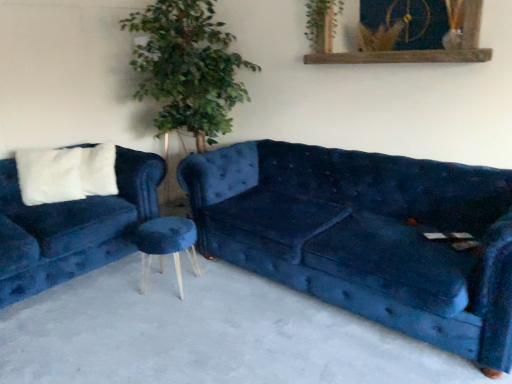
Find the location of a particular element. free space to the left of velvet blue stool at center is located at coordinates (118, 281).